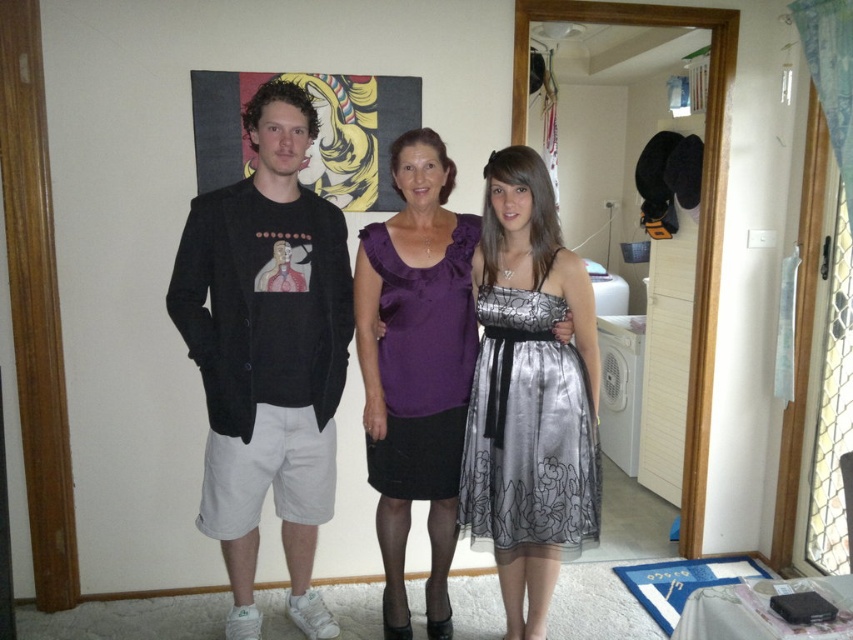
You are standing in the room and want to place a small decorative item at point (560, 307). The item requires a flat surface at least 6 feet away from the camera to avoid being in the foreground. Will this point work?

The distance of point (560, 307) from the camera is 7.04 feet, which is more than the required 6 feet. Therefore, this point is suitable for placing the decorative item as it meets the distance requirement.

You are a photographer setting up for a family portrait. You notice two purple garments in the scene, the silky purple blouse at center and the purple satin dress at center. Which garment should you adjust in the composition to ensure both are visible in the frame?

The silky purple blouse at center is much taller than the purple satin dress at center, so you should adjust the position of the silky purple blouse at center to ensure both garments are visible in the frame.

You are standing in the room where the three people are. You want to take a photo of the point at coordinates point (x=260, y=90) without moving any objects. Can you reach that point to take the photo?

The point (x=260, y=90) is 2.08 meters away from viewer, so yes, you can reach that point to take the photo as it is within a reasonable distance.